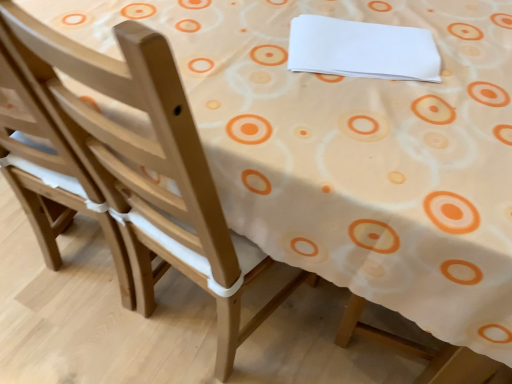
Where is `white paper at upper center`? white paper at upper center is located at coordinates (362, 49).

What do you see at coordinates (362, 49) in the screenshot? I see `white paper at upper center` at bounding box center [362, 49].

What is the approximate width of white paper at upper center?

white paper at upper center is 31.52 centimeters wide.

The height and width of the screenshot is (384, 512). What do you see at coordinates (47, 161) in the screenshot?
I see `light wood chair at left` at bounding box center [47, 161].

Measure the distance between light wood chair at left and camera.

A distance of 21.22 inches exists between light wood chair at left and camera.

Image resolution: width=512 pixels, height=384 pixels. Find the location of `light wood chair at left`. light wood chair at left is located at coordinates (47, 161).

Find the location of a particular element. The height and width of the screenshot is (384, 512). white paper at upper center is located at coordinates (362, 49).

Between light wood chair at left and white paper at upper center, which one appears on the right side from the viewer's perspective?

white paper at upper center.

Is the position of light wood chair at left more distant than that of white paper at upper center?

No, it is in front of white paper at upper center.

Between point (59, 142) and point (310, 19), which one is positioned behind?

The point (310, 19) is more distant.

From the image's perspective, is light wood chair at left over white paper at upper center?

No, from the image's perspective, light wood chair at left is not on top of white paper at upper center.

From a real-world perspective, relative to white paper at upper center, is light wood chair at left vertically above or below?

Clearly, from a real-world perspective, light wood chair at left is below white paper at upper center.

Considering the sizes of objects light wood chair at left and white paper at upper center in the image provided, who is thinner, light wood chair at left or white paper at upper center?

white paper at upper center is thinner.

Who is taller, light wood chair at left or white paper at upper center?

Standing taller between the two is light wood chair at left.

Is light wood chair at left bigger or smaller than white paper at upper center?

Clearly, light wood chair at left is larger in size than white paper at upper center.

Would you say light wood chair at left is inside or outside white paper at upper center?

light wood chair at left exists outside the volume of white paper at upper center.

Are light wood chair at left and white paper at upper center located far from each other?

No.

In the scene shown: Is light wood chair at left oriented away from white paper at upper center?

light wood chair at left does not have its back to white paper at upper center.

How much distance is there between light wood chair at left and white paper at upper center?

24.63 inches.

Where is `chair in front of the white paper at upper center`? The height and width of the screenshot is (384, 512). chair in front of the white paper at upper center is located at coordinates (47, 161).

Which is more to the left, white paper at upper center or light wood chair at left?

light wood chair at left is more to the left.

Relative to light wood chair at left, is white paper at upper center in front or behind?

white paper at upper center is positioned farther from the viewer than light wood chair at left.

Is point (385, 68) positioned after point (25, 212)?

No, it is not.

From the image's perspective, which one is positioned higher, white paper at upper center or light wood chair at left?

white paper at upper center, from the image's perspective.

From a real-world perspective, is white paper at upper center under light wood chair at left?

No, from a real-world perspective, white paper at upper center is not below light wood chair at left.

Which of these two, white paper at upper center or light wood chair at left, is wider?

Wider between the two is light wood chair at left.

Between white paper at upper center and light wood chair at left, which one has less height?

With less height is white paper at upper center.

Between white paper at upper center and light wood chair at left, which one has larger size?

light wood chair at left is bigger.

Is white paper at upper center completely or partially outside of light wood chair at left?

white paper at upper center is positioned outside light wood chair at left.

Is white paper at upper center beside light wood chair at left?

They are not placed beside each other.

Is white paper at upper center aimed at light wood chair at left?

Yes, white paper at upper center is aimed at light wood chair at left.

Locate an element on the screen. chair below the white paper at upper center (from the image's perspective) is located at coordinates (47, 161).

In order to click on notepad that is above the light wood chair at left (from the image's perspective) in this screenshot , I will do `click(362, 49)`.

Where is `chair that is on the left side of white paper at upper center`? chair that is on the left side of white paper at upper center is located at coordinates (47, 161).